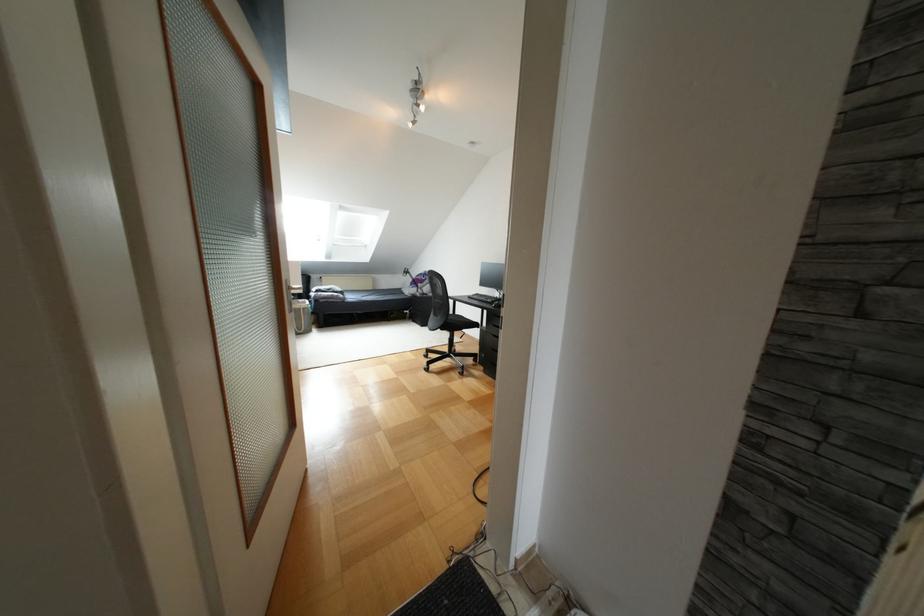
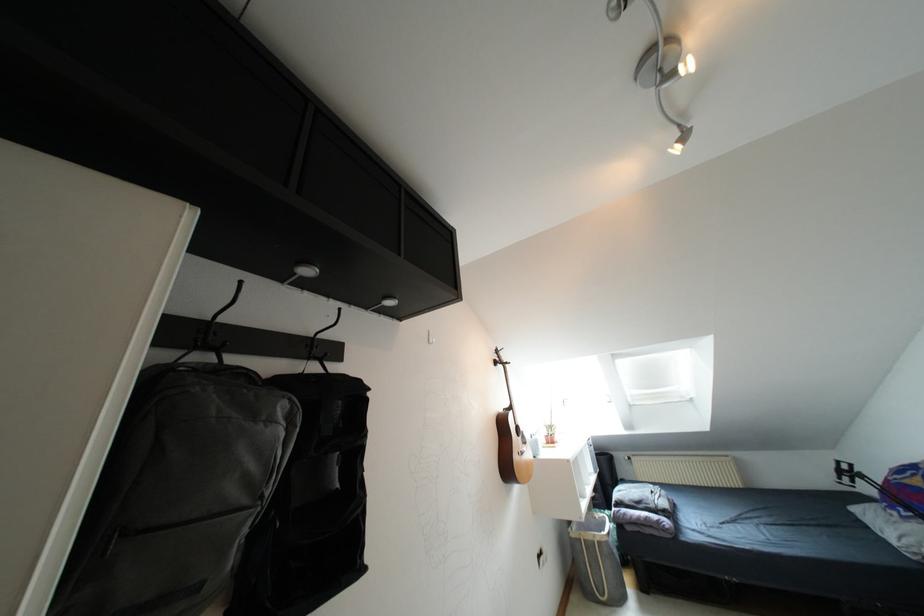
The point at (309,330) is marked in the first image. Where is the corresponding point in the second image?

(618, 599)